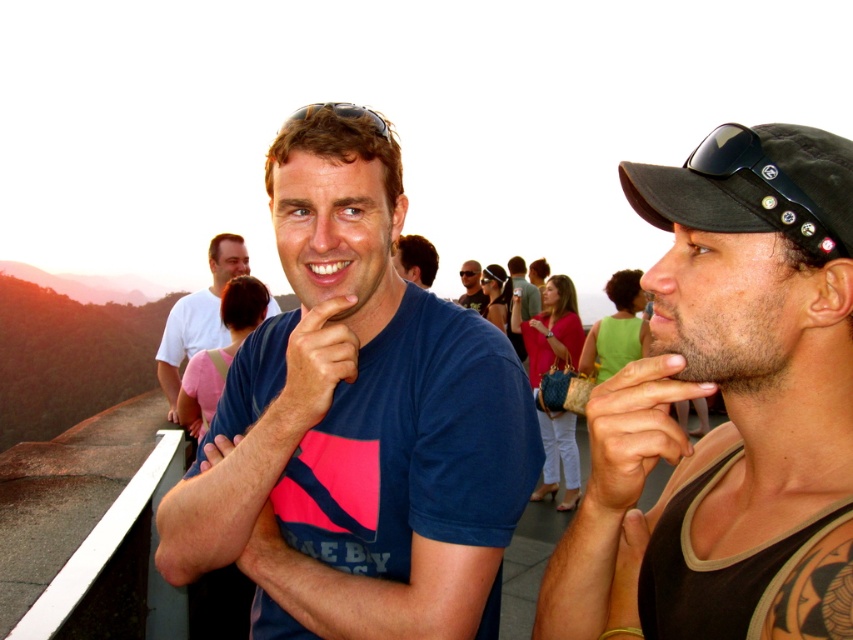
Question: Where is pink fabric hand at center located in relation to matte blue t-shirt at center in the image?

Choices:
 (A) above
 (B) below

Answer: (A)

Question: Which object is positioned closest to the blue cotton t-shirt at center?

Choices:
 (A) matte black sunglasses at center
 (B) black fabric cap at right
 (C) green fabric shirt at center
 (D) black fabric baseball cap at right

Answer: (B)

Question: Among these objects, which one is farthest from the camera?

Choices:
 (A) hair at upper left
 (B) matte black sunglasses at center
 (C) blue cotton t-shirt at center

Answer: (B)

Question: Can you confirm if matte blue t-shirt at center is thinner than smooth skin hand at center?

Choices:
 (A) no
 (B) yes

Answer: (A)

Question: Does black fabric cap at right appear on the right side of green fabric shirt at center?

Choices:
 (A) no
 (B) yes

Answer: (A)

Question: Which object is farther from the camera taking this photo?

Choices:
 (A) hair at upper left
 (B) black fabric baseball cap at right
 (C) blue cotton t-shirt at center
 (D) pink fabric hand at center

Answer: (A)